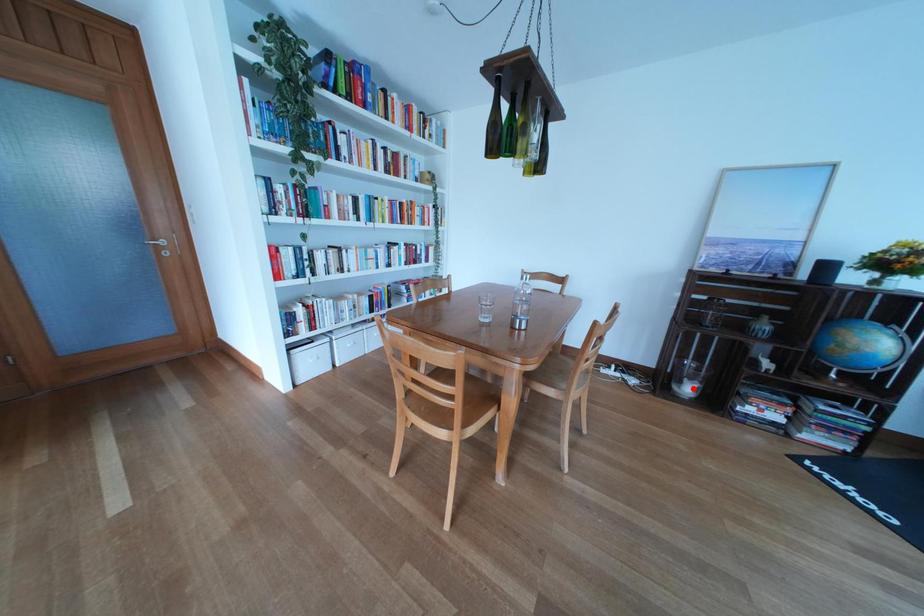
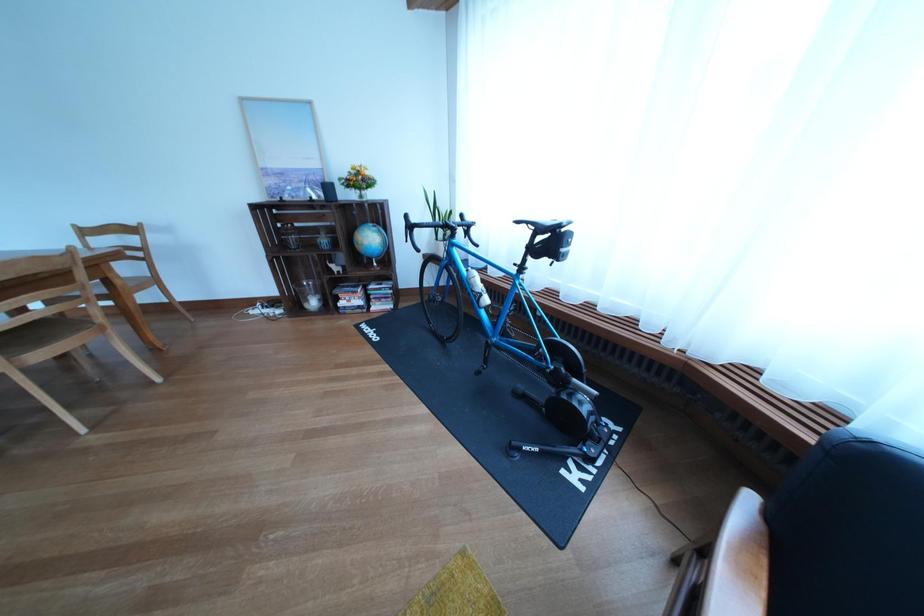
Find the pixel in the second image that matches the highlighted location in the first image.

(321, 306)